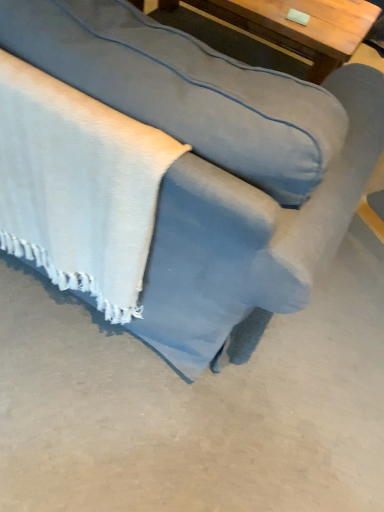
Question: Does wooden table at upper center have a lesser width compared to suede-like blue couch at center?

Choices:
 (A) no
 (B) yes

Answer: (B)

Question: Would you consider wooden table at upper center to be distant from suede-like blue couch at center?

Choices:
 (A) yes
 (B) no

Answer: (A)

Question: Does wooden table at upper center have a greater height compared to suede-like blue couch at center?

Choices:
 (A) no
 (B) yes

Answer: (A)

Question: Can you confirm if wooden table at upper center is positioned to the left of suede-like blue couch at center?

Choices:
 (A) yes
 (B) no

Answer: (B)

Question: Is wooden table at upper center bigger than suede-like blue couch at center?

Choices:
 (A) no
 (B) yes

Answer: (A)

Question: From the image's perspective, is suede-like blue couch at center positioned above or below wooden table at upper center?

Choices:
 (A) below
 (B) above

Answer: (A)

Question: Is suede-like blue couch at center wider or thinner than wooden table at upper center?

Choices:
 (A) thin
 (B) wide

Answer: (B)

Question: Is point (198, 157) positioned closer to the camera than point (360, 53)?

Choices:
 (A) farther
 (B) closer

Answer: (B)

Question: Considering the relative positions of suede-like blue couch at center and wooden table at upper center in the image provided, is suede-like blue couch at center to the left or to the right of wooden table at upper center?

Choices:
 (A) left
 (B) right

Answer: (A)

Question: Is wooden table at upper center bigger or smaller than suede-like blue couch at center?

Choices:
 (A) big
 (B) small

Answer: (B)

Question: Considering the positions of wooden table at upper center and suede-like blue couch at center in the image, is wooden table at upper center taller or shorter than suede-like blue couch at center?

Choices:
 (A) tall
 (B) short

Answer: (B)

Question: Looking at their shapes, would you say wooden table at upper center is wider or thinner than suede-like blue couch at center?

Choices:
 (A) thin
 (B) wide

Answer: (A)

Question: Visually, is wooden table at upper center positioned to the left or to the right of suede-like blue couch at center?

Choices:
 (A) left
 (B) right

Answer: (B)

Question: In the image, is wooden table at upper center on the left side or the right side of white textured blanket at lower left?

Choices:
 (A) right
 (B) left

Answer: (A)

Question: Considering the positions of point (243, 10) and point (6, 228), is point (243, 10) closer or farther from the camera than point (6, 228)?

Choices:
 (A) closer
 (B) farther

Answer: (B)